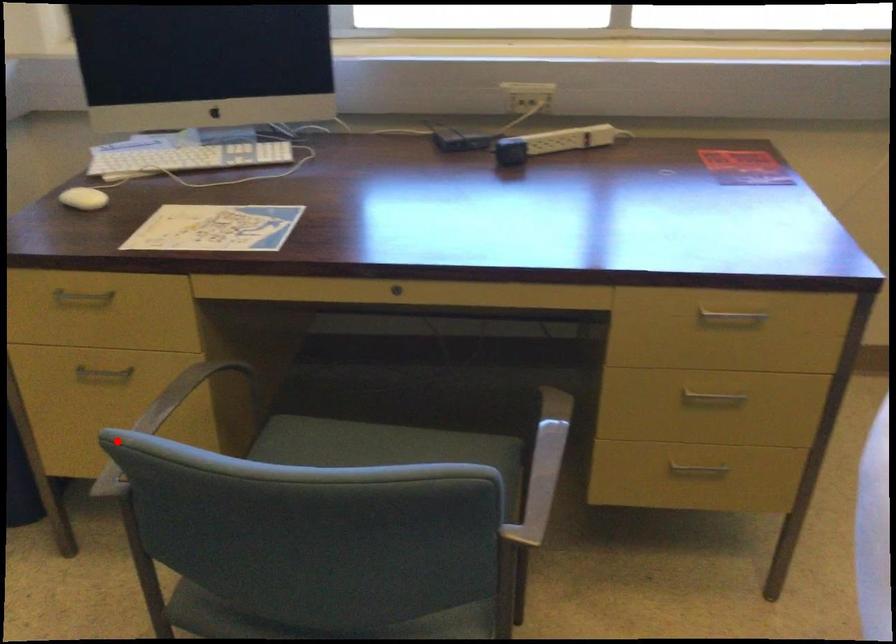
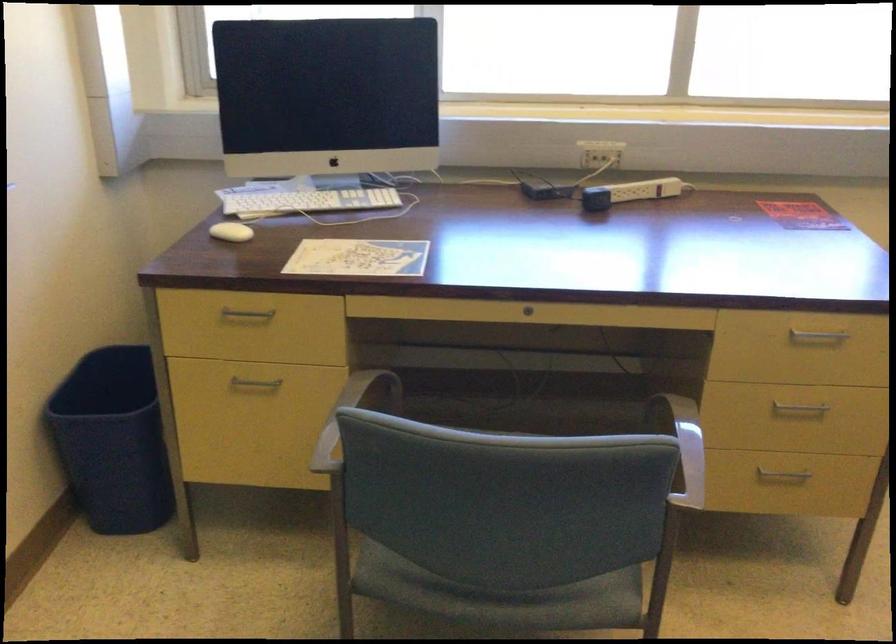
Question: I am providing you with two images of the same scene from different viewpoints. Given a red point in image1, look at the same physical point in image2. Is it:

Choices:
 (A) Closer to the viewpoint
 (B) Farther from the viewpoint

Answer: (B)